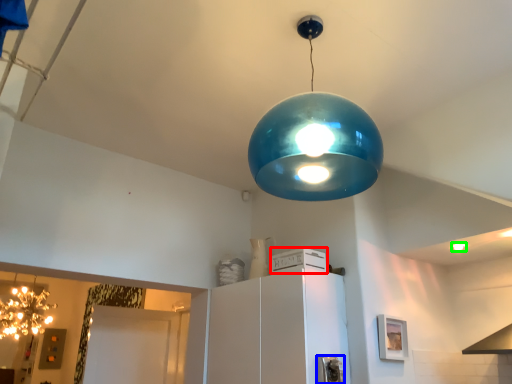
Question: Based on their relative distances, which object is farther from appliance (highlighted by a red box)? Choose from appliance (highlighted by a blue box) and light bulb (highlighted by a green box).

Choices:
 (A) appliance
 (B) light bulb

Answer: (B)